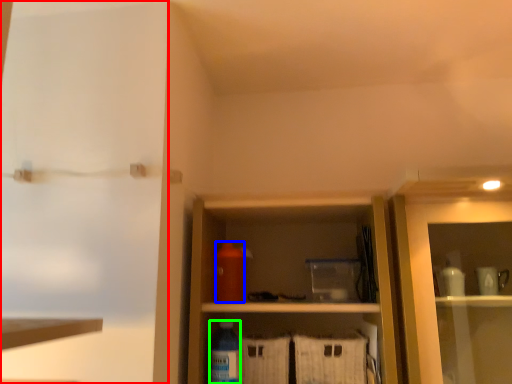
Question: Estimate the real-world distances between objects in this image. Which object is farther from screen door (highlighted by a red box), bottle (highlighted by a blue box) or bottle (highlighted by a green box)?

Choices:
 (A) bottle
 (B) bottle

Answer: (B)